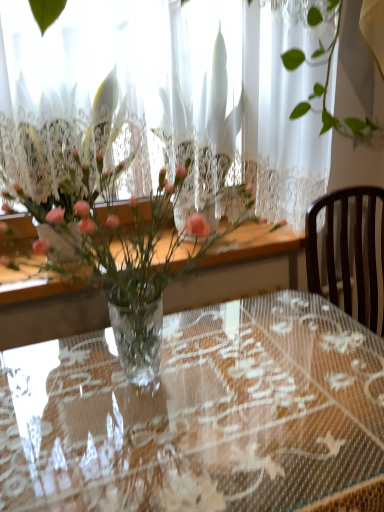
Find the location of a particular element. The image size is (384, 512). vacant area to the right of translucent glass vase at center is located at coordinates (302, 367).